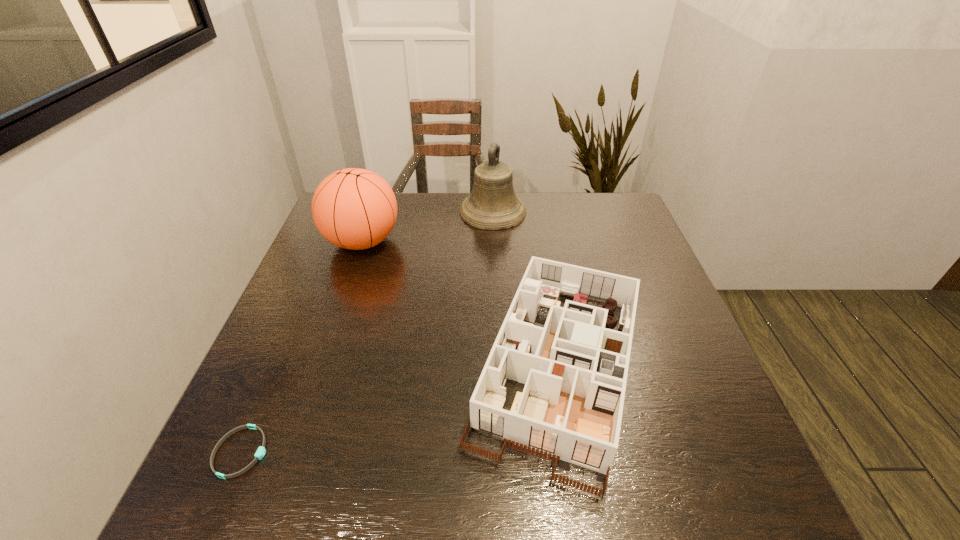
What are the coordinates of `bell` in the screenshot? It's located at (492, 205).

Locate an element on the screen. Image resolution: width=960 pixels, height=540 pixels. basketball is located at coordinates (353, 208).

This screenshot has height=540, width=960. Find the location of `dollhouse`. dollhouse is located at coordinates (574, 368).

Identify the location of wristband. The width and height of the screenshot is (960, 540). (261, 451).

Locate an element on the screen. Image resolution: width=960 pixels, height=540 pixels. free location located on the right of the bell is located at coordinates (630, 212).

At what (x,y) coordinates should I click in order to perform the action: click on vacant space located on the front of the basketball. Please return your answer as a coordinate pair (x, y). Looking at the image, I should click on pos(321,364).

The image size is (960, 540). Find the location of `vacant space located 0.100m on the back of the dollhouse`. vacant space located 0.100m on the back of the dollhouse is located at coordinates (540, 260).

You are a GUI agent. You are given a task and a screenshot of the screen. Output one action in this format:
    pyautogui.click(x=<x>, y=<y>)
    Task: Click on the vacant space located 0.370m on the buckle of the wristband
    This screenshot has height=540, width=960.
    Given the screenshot: What is the action you would take?
    pyautogui.click(x=471, y=452)

Locate an element on the screen. The height and width of the screenshot is (540, 960). bell that is at the far edge is located at coordinates (492, 205).

The image size is (960, 540). I want to click on basketball that is at the far edge, so (x=353, y=208).